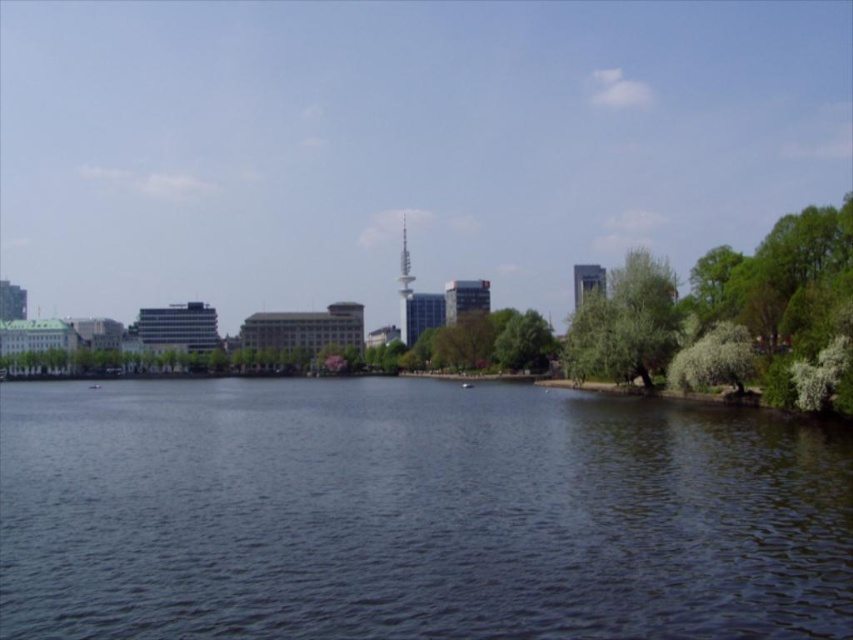
You are a city planner analyzing the urban waterfront scene. You need to determine if the dark blue water at center is visible above the metallic silver tower at center. Based on the scene, what is your conclusion?

The dark blue water at center is shorter than the metallic silver tower at center, so it is not visible above the tower.

You are an architect designing a new building and want to ensure it doesn not block the view of the green leafy tree at right from the metallic silver tower at center. Given their sizes, which object should be placed closer to the observer to maintain the view?

The green leafy tree at right is larger in size than the metallic silver tower at center. To ensure the view of the tree remains unobstructed from the tower, the tree should be placed closer to the observer so that its larger size doesn t block the sightline.